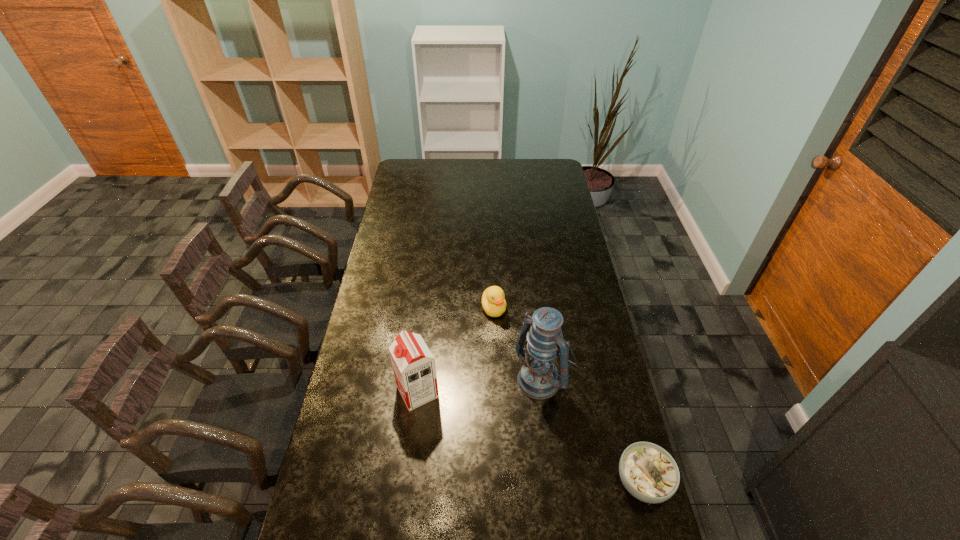
Image resolution: width=960 pixels, height=540 pixels. What are the coordinates of `vacant region located 0.380m on the front-facing side of the second object from right to left` in the screenshot? It's located at (437, 476).

Where is `free point located 0.380m on the front-facing side of the second object from right to left`? The height and width of the screenshot is (540, 960). free point located 0.380m on the front-facing side of the second object from right to left is located at coordinates (437, 476).

Find the location of `free space located 0.140m on the front-facing side of the second object from right to left`. free space located 0.140m on the front-facing side of the second object from right to left is located at coordinates (495, 422).

Find the location of `vacant region located 0.330m at the beak of the duck`. vacant region located 0.330m at the beak of the duck is located at coordinates (516, 396).

You are a GUI agent. You are given a task and a screenshot of the screen. Output one action in this format:
    pyautogui.click(x=<x>, y=<y>)
    Task: Click on the vacant space located at the beak of the duck
    
    Given the screenshot: What is the action you would take?
    (509, 368)

This screenshot has height=540, width=960. Find the location of `free space located at the beak of the duck`. free space located at the beak of the duck is located at coordinates (507, 359).

At what (x,y) coordinates should I click in order to perform the action: click on object at the near edge. Please return your answer as a coordinate pair (x, y). The width and height of the screenshot is (960, 540). Looking at the image, I should click on (648, 472).

This screenshot has width=960, height=540. I want to click on soup bowl that is at the right edge, so click(648, 472).

You are a GUI agent. You are given a task and a screenshot of the screen. Output one action in this format:
    pyautogui.click(x=<x>, y=<y>)
    Task: Click on the lantern present at the right edge
    Image resolution: width=960 pixels, height=540 pixels.
    Given the screenshot: What is the action you would take?
    pyautogui.click(x=538, y=378)

Identify the location of object located in the near right corner section of the desktop. This screenshot has height=540, width=960. (648, 472).